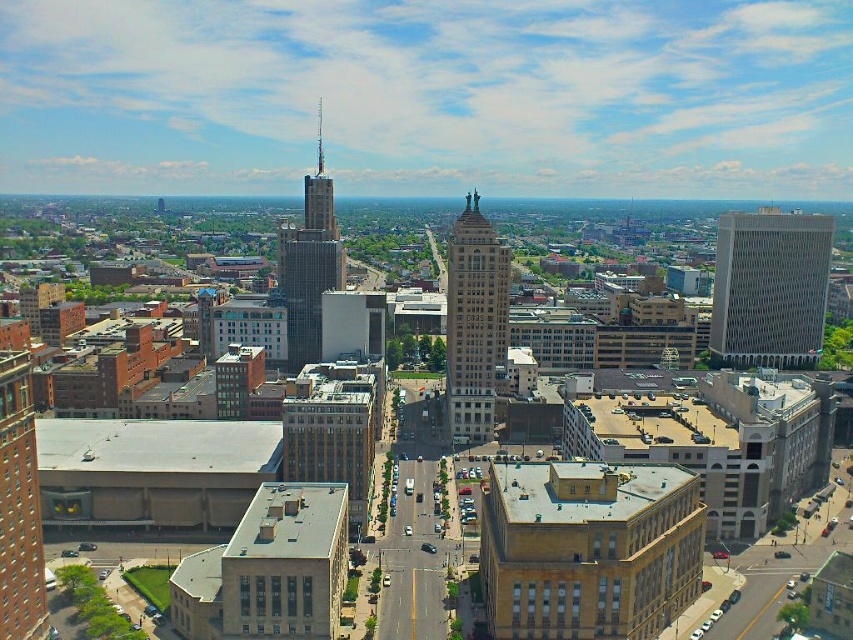
Question: Which object is farther from the camera taking this photo?

Choices:
 (A) beige stone tower at center
 (B) brown brick building at lower left
 (C) white textured building at center-right
 (D) glass skyscraper at center

Answer: (C)

Question: Among these points, which one is farthest from the camera?

Choices:
 (A) (38, 604)
 (B) (468, 264)

Answer: (B)

Question: Does beige stone tower at center appear on the right side of glass skyscraper at center?

Choices:
 (A) yes
 (B) no

Answer: (A)

Question: Which object is the farthest from the beige stone tower at center?

Choices:
 (A) white textured building at center-right
 (B) brown brick building at lower left

Answer: (B)

Question: Is white textured building at center-right in front of beige stone tower at center?

Choices:
 (A) no
 (B) yes

Answer: (A)

Question: Is brown brick building at lower left thinner than glass skyscraper at center?

Choices:
 (A) yes
 (B) no

Answer: (A)